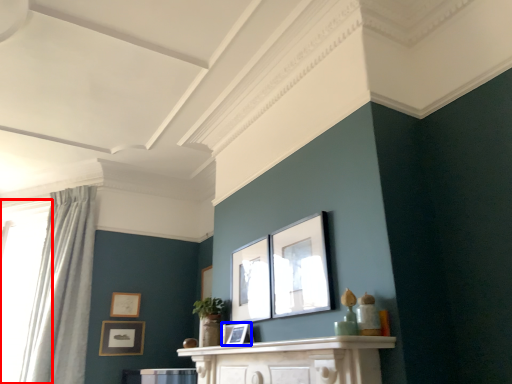
Question: Among these objects, which one is nearest to the camera, window (highlighted by a red box) or picture frame (highlighted by a blue box)?

Choices:
 (A) window
 (B) picture frame

Answer: (B)